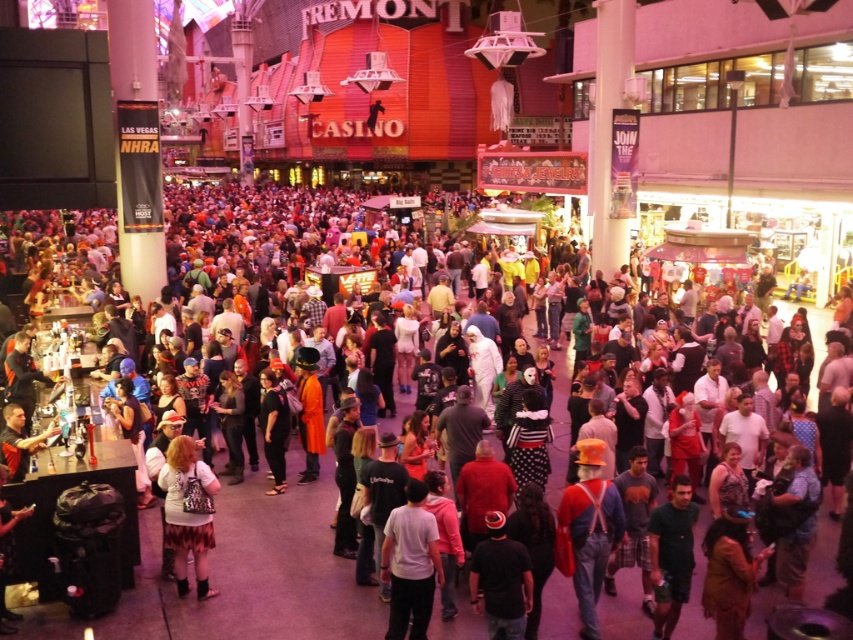
Can you confirm if white matte shirt at center is positioned above black matte jacket at center?

No, white matte shirt at center is not above black matte jacket at center.

Is white matte shirt at center to the left of black matte jacket at center from the viewer's perspective?

Incorrect, white matte shirt at center is not on the left side of black matte jacket at center.

Measure the distance between point (x=415, y=604) and camera.

The distance of point (x=415, y=604) from camera is 22.35 meters.

Where is `white matte shirt at center`? The width and height of the screenshot is (853, 640). white matte shirt at center is located at coordinates (410, 563).

Which is more to the right, matte white shirt at lower left or black matte jacket at center?

black matte jacket at center is more to the right.

Between matte white shirt at lower left and black matte jacket at center, which one has more height?

matte white shirt at lower left is taller.

I want to click on matte white shirt at lower left, so click(x=187, y=513).

Measure the distance between orange felt hat at center and camera.

orange felt hat at center is 73.40 feet away from camera.

What do you see at coordinates (590, 529) in the screenshot? I see `orange felt hat at center` at bounding box center [590, 529].

Describe the element at coordinates (590, 529) in the screenshot. I see `orange felt hat at center` at that location.

Locate an element on the screen. orange felt hat at center is located at coordinates (590, 529).